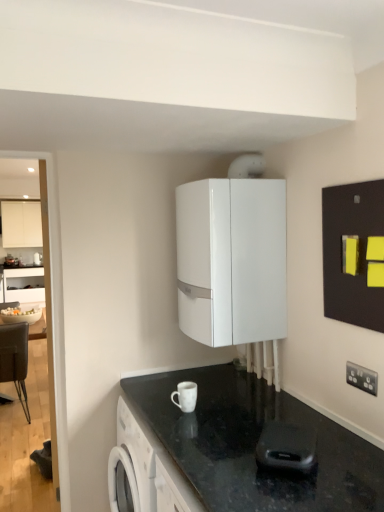
Question: Does white plastic electric outlet at lower right have a lesser height compared to black rubber remote control at lower center, acting as the 3th appliance starting from the top?

Choices:
 (A) no
 (B) yes

Answer: (B)

Question: Is the position of white plastic electric outlet at lower right less distant than that of black rubber remote control at lower center, placed as the third appliance when sorted from left to right?

Choices:
 (A) yes
 (B) no

Answer: (B)

Question: Does white plastic electric outlet at lower right contain black rubber remote control at lower center, the first appliance in the right-to-left sequence?

Choices:
 (A) no
 (B) yes

Answer: (A)

Question: Considering the relative sizes of white plastic electric outlet at lower right and black rubber remote control at lower center, acting as the 3th appliance starting from the top, in the image provided, is white plastic electric outlet at lower right thinner than black rubber remote control at lower center, acting as the 3th appliance starting from the top,?

Choices:
 (A) yes
 (B) no

Answer: (A)

Question: Would you consider white plastic electric outlet at lower right to be distant from black rubber remote control at lower center, which ranks as the first appliance in bottom-to-top order?

Choices:
 (A) no
 (B) yes

Answer: (A)

Question: Is brown leather chair at left inside or outside of black granite countertop at lower center?

Choices:
 (A) inside
 (B) outside

Answer: (B)

Question: Is brown leather chair at left to the left or to the right of black granite countertop at lower center in the image?

Choices:
 (A) right
 (B) left

Answer: (B)

Question: Is brown leather chair at left taller or shorter than black granite countertop at lower center?

Choices:
 (A) tall
 (B) short

Answer: (A)

Question: In the image, is brown leather chair at left positioned in front of or behind black granite countertop at lower center?

Choices:
 (A) behind
 (B) front

Answer: (A)

Question: From the image's perspective, is brown leather chair at left above or below black rubber remote control at lower center, the first appliance in the right-to-left sequence?

Choices:
 (A) below
 (B) above

Answer: (A)

Question: Considering the positions of brown leather chair at left and black rubber remote control at lower center, arranged as the first appliance when viewed from the front, in the image, is brown leather chair at left wider or thinner than black rubber remote control at lower center, arranged as the first appliance when viewed from the front,?

Choices:
 (A) thin
 (B) wide

Answer: (B)

Question: Considering the positions of brown leather chair at left and black rubber remote control at lower center, acting as the 3th appliance starting from the top, in the image, is brown leather chair at left bigger or smaller than black rubber remote control at lower center, acting as the 3th appliance starting from the top,?

Choices:
 (A) big
 (B) small

Answer: (A)

Question: Relative to black rubber remote control at lower center, arranged as the first appliance when viewed from the front, is brown leather chair at left in front or behind?

Choices:
 (A) behind
 (B) front

Answer: (A)

Question: Is white glossy microwave at upper center bigger or smaller than white glossy boiler at upper center, the 3th appliance from the bottom?

Choices:
 (A) small
 (B) big

Answer: (B)

Question: Considering the positions of white glossy microwave at upper center and white glossy boiler at upper center, the first appliance positioned from the top, in the image, is white glossy microwave at upper center wider or thinner than white glossy boiler at upper center, the first appliance positioned from the top,?

Choices:
 (A) wide
 (B) thin

Answer: (B)